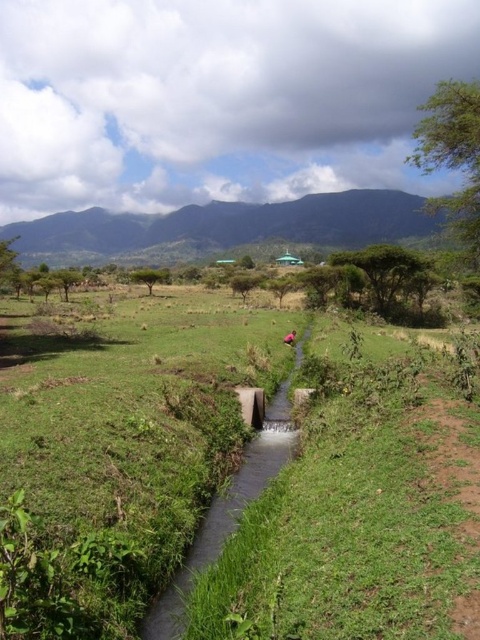
Question: Among these points, which one is farthest from the camera?

Choices:
 (A) (285, 464)
 (B) (176, 506)

Answer: (A)

Question: Is green grassy at center thinner than green concrete stream at center?

Choices:
 (A) yes
 (B) no

Answer: (B)

Question: Which of the following is the farthest from the observer?

Choices:
 (A) green grassy at center
 (B) green concrete stream at center

Answer: (B)

Question: Is green grassy at center below green concrete stream at center?

Choices:
 (A) yes
 (B) no

Answer: (B)

Question: Where is green grassy at center located in relation to green concrete stream at center in the image?

Choices:
 (A) right
 (B) left

Answer: (B)

Question: Which object is closer to the camera taking this photo?

Choices:
 (A) green concrete stream at center
 (B) green grassy at center

Answer: (B)